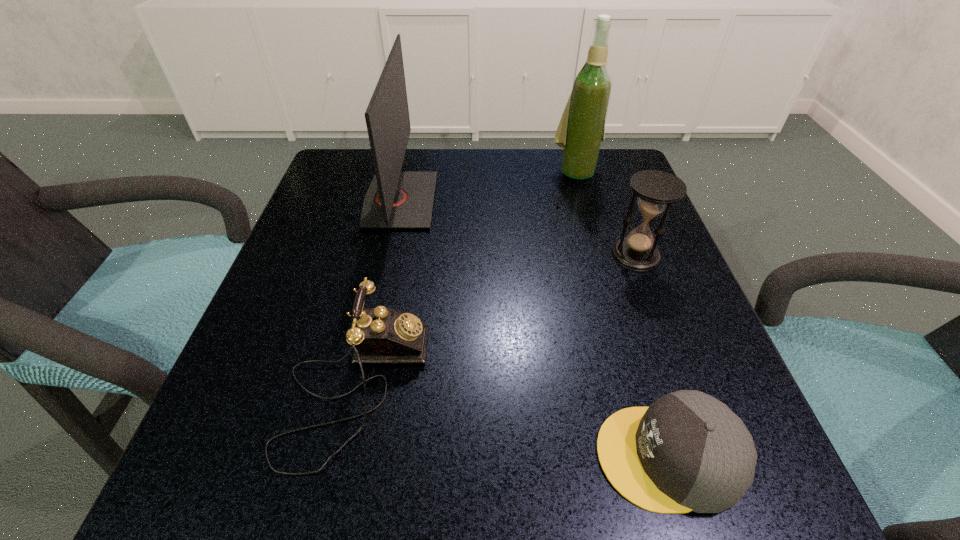
The height and width of the screenshot is (540, 960). I want to click on cap that is at the right edge, so click(x=687, y=451).

I want to click on object that is at the far left corner, so click(x=396, y=199).

Where is `object present at the near left corner`? The height and width of the screenshot is (540, 960). object present at the near left corner is located at coordinates (380, 335).

Find the location of `object located in the far right corner section of the desktop`. object located in the far right corner section of the desktop is located at coordinates (581, 130).

Where is `object positioned at the near right corner`? object positioned at the near right corner is located at coordinates (687, 451).

In the image, there is a desktop. Find the location of `vacant area at the far edge`. vacant area at the far edge is located at coordinates (527, 159).

Where is `free space at the near edge of the desktop`? The image size is (960, 540). free space at the near edge of the desktop is located at coordinates (369, 493).

In the image, there is a desktop. Identify the location of vacant area at the left edge. (286, 268).

In the image, there is a desktop. Where is `vacant region at the right edge`? This screenshot has height=540, width=960. vacant region at the right edge is located at coordinates (713, 351).

Where is `vacant space at the far left corner of the desktop`? Image resolution: width=960 pixels, height=540 pixels. vacant space at the far left corner of the desktop is located at coordinates (336, 167).